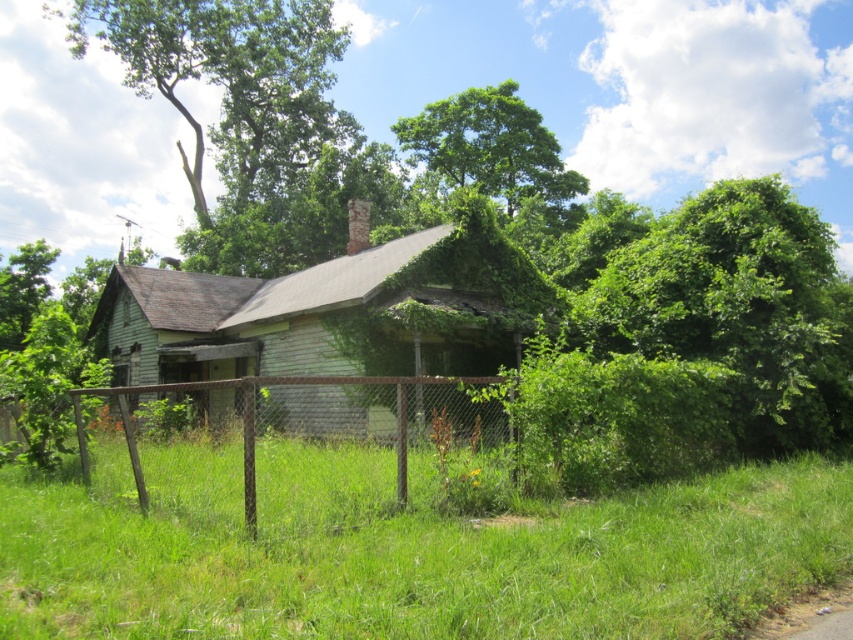
Based on the photo, which is below, green leafy tree at upper right or green leafy tree at upper left?

Positioned lower is green leafy tree at upper right.

Does point (788, 336) lie in front of point (289, 115)?

That is True.

Locate an element on the screen. The image size is (853, 640). green leafy tree at upper right is located at coordinates (738, 307).

Is green leafy tree at upper left taller than green leafy tree at upper center?

Indeed, green leafy tree at upper left has a greater height compared to green leafy tree at upper center.

Who is lower down, green leafy tree at upper left or green leafy tree at upper center?

green leafy tree at upper center is below.

Which is behind, point (178, 113) or point (445, 179)?

The point (178, 113) is behind.

I want to click on green leafy tree at upper left, so click(x=229, y=77).

Is green grass at lower center to the right of green leafy tree at upper center from the viewer's perspective?

Incorrect, green grass at lower center is not on the right side of green leafy tree at upper center.

Does green grass at lower center have a larger size compared to green leafy tree at upper center?

No, green grass at lower center is not bigger than green leafy tree at upper center.

Does point (198, 572) come in front of point (494, 106)?

Yes.

At what (x,y) coordinates should I click in order to perform the action: click on green grass at lower center. Please return your answer as a coordinate pair (x, y). This screenshot has height=640, width=853. Looking at the image, I should click on (404, 550).